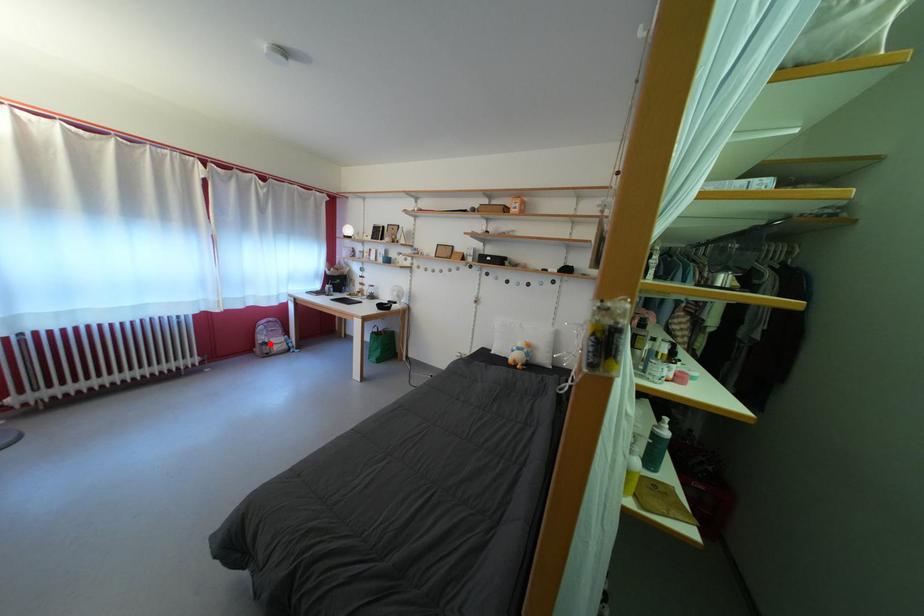
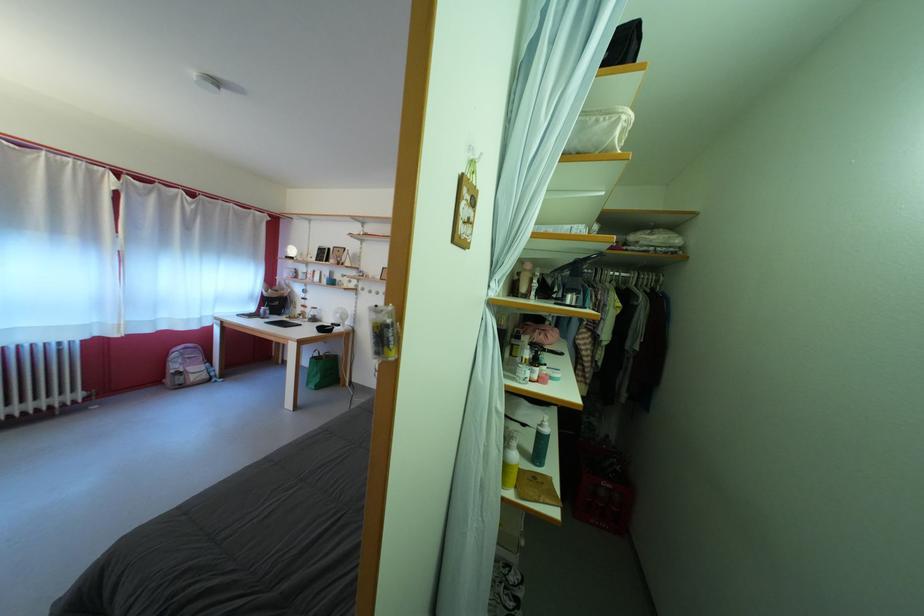
Where in the second image is the point corresponding to the highlighted location from the first image?

(184, 373)